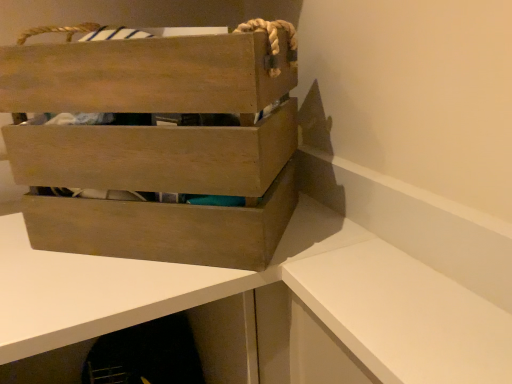
Question: Does wooden crate at upper left have a lesser height compared to wooden crate at upper left?

Choices:
 (A) yes
 (B) no

Answer: (B)

Question: Is wooden crate at upper left aimed at wooden crate at upper left?

Choices:
 (A) yes
 (B) no

Answer: (B)

Question: From the image's perspective, is wooden crate at upper left beneath wooden crate at upper left?

Choices:
 (A) yes
 (B) no

Answer: (A)

Question: Is wooden crate at upper left facing away from wooden crate at upper left?

Choices:
 (A) yes
 (B) no

Answer: (B)

Question: From a real-world perspective, is wooden crate at upper left positioned under wooden crate at upper left based on gravity?

Choices:
 (A) yes
 (B) no

Answer: (A)

Question: Is wooden crate at upper left inside wooden crate at upper left?

Choices:
 (A) yes
 (B) no

Answer: (B)

Question: Could you tell me if wooden crate at upper left is turned towards wooden crate at upper left?

Choices:
 (A) no
 (B) yes

Answer: (A)

Question: Considering the relative sizes of wooden crate at upper left and wooden crate at upper left in the image provided, is wooden crate at upper left bigger than wooden crate at upper left?

Choices:
 (A) no
 (B) yes

Answer: (A)

Question: Can you confirm if wooden crate at upper left is shorter than wooden crate at upper left?

Choices:
 (A) no
 (B) yes

Answer: (B)

Question: Does wooden crate at upper left contain wooden crate at upper left?

Choices:
 (A) no
 (B) yes

Answer: (A)

Question: Is wooden crate at upper left at the back of wooden crate at upper left?

Choices:
 (A) yes
 (B) no

Answer: (B)

Question: Is wooden crate at upper left wider than wooden crate at upper left?

Choices:
 (A) no
 (B) yes

Answer: (A)

Question: From the image's perspective, is wooden crate at upper left positioned above or below wooden crate at upper left?

Choices:
 (A) above
 (B) below

Answer: (A)